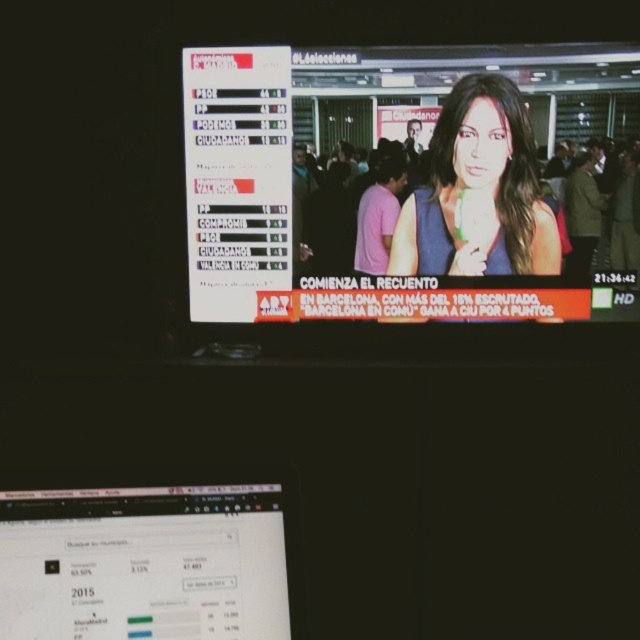
Question: Can you confirm if matte black screen at lower center is positioned below matte blue dress at center?

Choices:
 (A) yes
 (B) no

Answer: (A)

Question: Based on their relative distances, which object is nearer to the matte black screen at lower center?

Choices:
 (A) matte white scoreboard at upper center
 (B) matte blue dress at center

Answer: (A)

Question: Which point is farther from the camera taking this photo?

Choices:
 (A) (52, 531)
 (B) (490, 104)
 (C) (401, 236)

Answer: (C)

Question: Which point is farther to the camera?

Choices:
 (A) matte black screen at lower center
 (B) matte white scoreboard at upper center
 (C) matte blue dress at center

Answer: (C)

Question: Is the position of matte white scoreboard at upper center more distant than that of matte black screen at lower center?

Choices:
 (A) no
 (B) yes

Answer: (B)

Question: Can you confirm if matte white scoreboard at upper center is wider than matte blue dress at center?

Choices:
 (A) no
 (B) yes

Answer: (B)